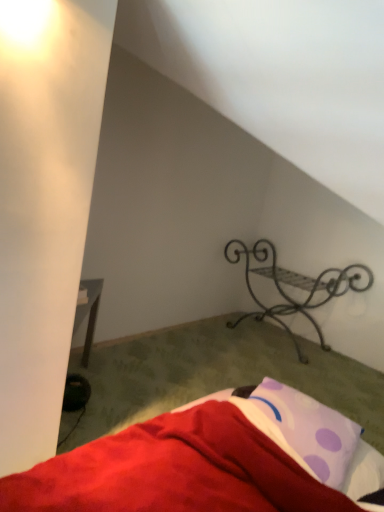
Locate an element on the screen. This screenshot has height=512, width=384. free space above red soft fabric bed at lower right (from a real-world perspective) is located at coordinates (221, 377).